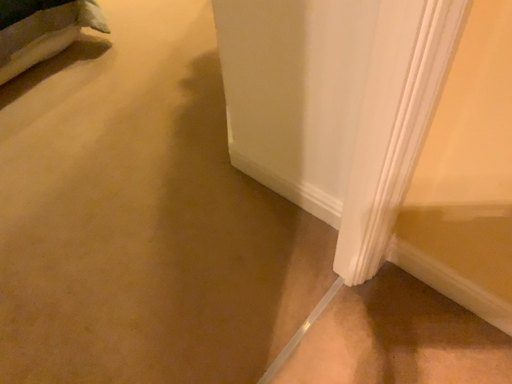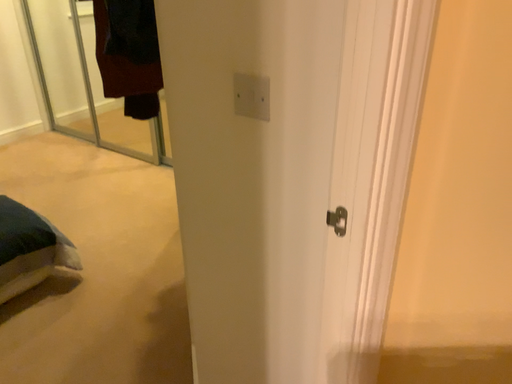
Question: How did the camera likely rotate when shooting the video?

Choices:
 (A) rotated downward
 (B) rotated upward

Answer: (B)